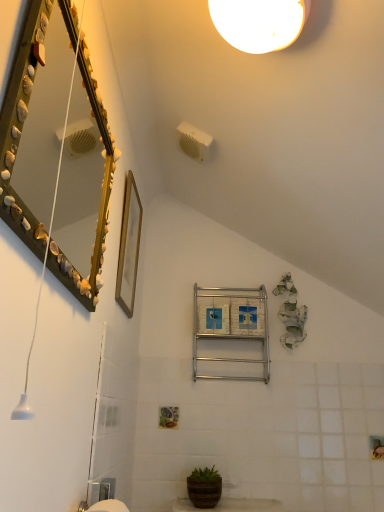
Where is `silver metallic towel rack at center`? The image size is (384, 512). silver metallic towel rack at center is located at coordinates (231, 324).

Measure the distance between point (124, 203) and camera.

Point (124, 203) and camera are 1.70 meters apart from each other.

What do you see at coordinates (129, 246) in the screenshot? I see `wooden picture frame at upper center` at bounding box center [129, 246].

Find the location of a particular element. brown textured pot at lower center is located at coordinates [204, 490].

Is point (127, 222) behind point (69, 170)?

No, it is in front of (69, 170).

Can you confirm if wooden picture frame at upper center is shorter than seashell-covered mirror at upper left?

Indeed, wooden picture frame at upper center has a lesser height compared to seashell-covered mirror at upper left.

From a real-world perspective, is brown textured pot at lower center located beneath wooden picture frame at upper center?

Yes, from a real-world perspective, brown textured pot at lower center is under wooden picture frame at upper center.

In the image, is brown textured pot at lower center positioned in front of or behind wooden picture frame at upper center?

Clearly, brown textured pot at lower center is behind wooden picture frame at upper center.

Based on the photo, would you say brown textured pot at lower center is a long distance from wooden picture frame at upper center?

That's not correct — brown textured pot at lower center is a little close to wooden picture frame at upper center.

Which of these two, brown textured pot at lower center or wooden picture frame at upper center, stands taller?

Standing taller between the two is wooden picture frame at upper center.

Between wooden picture frame at upper center and brown textured pot at lower center, which one appears on the left side from the viewer's perspective?

From the viewer's perspective, wooden picture frame at upper center appears more on the left side.

Does wooden picture frame at upper center lie in front of brown textured pot at lower center?

Yes.

From a real-world perspective, is wooden picture frame at upper center positioned over brown textured pot at lower center based on gravity?

Yes, from a real-world perspective, wooden picture frame at upper center is above brown textured pot at lower center.

From a real-world perspective, is wooden picture frame at upper center physically below silver metallic towel rack at center?

No, from a real-world perspective, wooden picture frame at upper center is not under silver metallic towel rack at center.

I want to click on picture frame to the left of silver metallic towel rack at center, so [x=129, y=246].

Is wooden picture frame at upper center oriented towards silver metallic towel rack at center?

No, wooden picture frame at upper center is not facing towards silver metallic towel rack at center.

From the image's perspective, is wooden picture frame at upper center located above or below silver metallic towel rack at center?

Clearly, from the image's perspective, wooden picture frame at upper center is above silver metallic towel rack at center.

Which object is wider, seashell-covered mirror at upper left or brown textured pot at lower center?

brown textured pot at lower center is wider.

Is seashell-covered mirror at upper left directly adjacent to brown textured pot at lower center?

No, seashell-covered mirror at upper left is not next to brown textured pot at lower center.

Which object is further away from the camera, seashell-covered mirror at upper left or brown textured pot at lower center?

brown textured pot at lower center is more distant.

Looking at this image, who is taller, seashell-covered mirror at upper left or brown textured pot at lower center?

With more height is seashell-covered mirror at upper left.

How different are the orientations of brown textured pot at lower center and seashell-covered mirror at upper left in degrees?

The angular difference between brown textured pot at lower center and seashell-covered mirror at upper left is 89.6 degrees.

Considering the relative positions of brown textured pot at lower center and seashell-covered mirror at upper left in the image provided, is brown textured pot at lower center to the left of seashell-covered mirror at upper left from the viewer's perspective?

In fact, brown textured pot at lower center is to the right of seashell-covered mirror at upper left.

Is seashell-covered mirror at upper left at the back of brown textured pot at lower center?

brown textured pot at lower center is not turned away from seashell-covered mirror at upper left.

Between brown textured pot at lower center and seashell-covered mirror at upper left, which one has more height?

seashell-covered mirror at upper left.

From the image's perspective, is seashell-covered mirror at upper left located beneath silver metallic towel rack at center?

Incorrect, from the image's perspective, seashell-covered mirror at upper left is higher than silver metallic towel rack at center.

Does seashell-covered mirror at upper left have a larger size compared to silver metallic towel rack at center?

No, seashell-covered mirror at upper left is not bigger than silver metallic towel rack at center.

In the image, is seashell-covered mirror at upper left positioned in front of or behind silver metallic towel rack at center?

seashell-covered mirror at upper left is positioned closer to the viewer than silver metallic towel rack at center.

Between seashell-covered mirror at upper left and silver metallic towel rack at center, which one appears on the left side from the viewer's perspective?

Positioned to the left is seashell-covered mirror at upper left.

This screenshot has width=384, height=512. I want to click on picture frame lying below the seashell-covered mirror at upper left (from the image's perspective), so click(129, 246).

I want to click on picture frame above the brown textured pot at lower center (from the image's perspective), so click(x=129, y=246).

Looking at the image, which one is located further to brown textured pot at lower center, silver metallic towel rack at center or wooden picture frame at upper center?

wooden picture frame at upper center is further to brown textured pot at lower center.

From the image, which object appears to be nearer to silver metallic towel rack at center, seashell-covered mirror at upper left or wooden picture frame at upper center?

wooden picture frame at upper center is positioned closer to the anchor silver metallic towel rack at center.

Looking at the image, which one is located closer to seashell-covered mirror at upper left, brown textured pot at lower center or silver metallic towel rack at center?

silver metallic towel rack at center is closer to seashell-covered mirror at upper left.

From the image, which object appears to be farther from silver metallic towel rack at center, seashell-covered mirror at upper left or brown textured pot at lower center?

seashell-covered mirror at upper left.

Considering their positions, is seashell-covered mirror at upper left positioned further to brown textured pot at lower center than silver metallic towel rack at center?

seashell-covered mirror at upper left is further to brown textured pot at lower center.

Considering their positions, is silver metallic towel rack at center positioned further to wooden picture frame at upper center than brown textured pot at lower center?

The object further to wooden picture frame at upper center is brown textured pot at lower center.

From the image, which object appears to be farther from brown textured pot at lower center, wooden picture frame at upper center or silver metallic towel rack at center?

Among the two, wooden picture frame at upper center is located further to brown textured pot at lower center.

From the image, which object appears to be nearer to seashell-covered mirror at upper left, wooden picture frame at upper center or silver metallic towel rack at center?

The object closer to seashell-covered mirror at upper left is wooden picture frame at upper center.

Find the location of `flowerpot located between seashell-covered mirror at upper left and silver metallic towel rack at center in the depth direction`. flowerpot located between seashell-covered mirror at upper left and silver metallic towel rack at center in the depth direction is located at coordinates (204, 490).

Where is `picture frame positioned between seashell-covered mirror at upper left and silver metallic towel rack at center from near to far`? picture frame positioned between seashell-covered mirror at upper left and silver metallic towel rack at center from near to far is located at coordinates (129, 246).

At what (x,y) coordinates should I click in order to perform the action: click on ladder between wooden picture frame at upper center and brown textured pot at lower center in the vertical direction. Please return your answer as a coordinate pair (x, y). The height and width of the screenshot is (512, 384). Looking at the image, I should click on (231, 324).

This screenshot has height=512, width=384. What are the coordinates of `picture frame between seashell-covered mirror at upper left and brown textured pot at lower center vertically` in the screenshot? It's located at (129, 246).